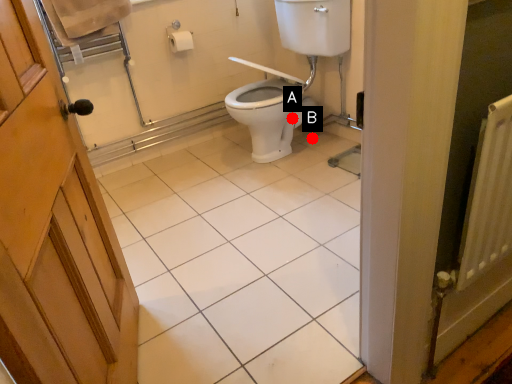
Question: Two points are circled on the image, labeled by A and B beside each circle. Which point is farther to the camera?

Choices:
 (A) A is further
 (B) B is further

Answer: (B)